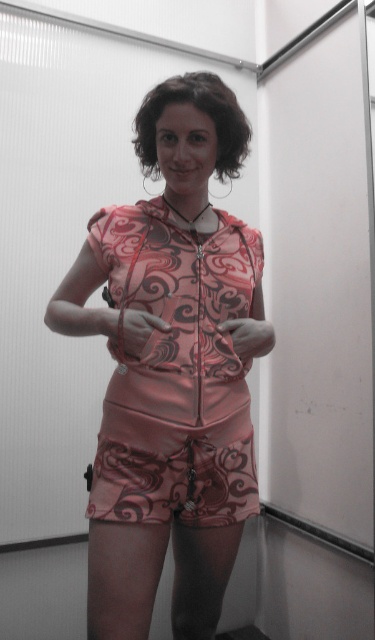
You are a photographer setting up for a photoshoot. You need to position your camera so that the pink satin dress at center is in focus. What is the minimum distance you should set your camera lens to ensure the dress is clearly visible?

The minimum distance you should set your camera lens is 1.11 meters to ensure the pink satin dress at center is clearly visible, as it is positioned 1.11 meters away from the camera.

Looking at this image, you are a fashion designer trying to decide whether two garments, the satin pink romper at center and the pink satin dress at center, can be displayed together on a single mannequin. The mannequin requires at least 2 inches of space between items. Based on the image, can they be placed together?

The satin pink romper at center is only 1.32 inches from the pink satin dress at center, which is less than the required 2 inches of space. Therefore, they cannot be displayed together on the same mannequin.

You are a fashion stylist helping a client choose between the satin pink romper at center and the pink satin dress at center for an event. The client wants to wear the outfit that requires less fabric. Which one should they choose?

The pink satin dress at center requires less fabric because it is smaller in size than the satin pink romper at center.